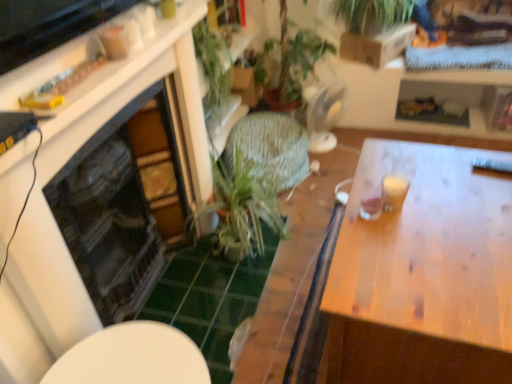
Locate an element on the screen. free point above white glossy table at lower center (from a real-world perspective) is located at coordinates (152, 354).